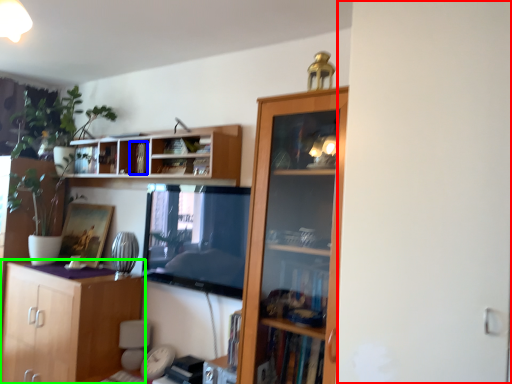
Question: Estimate the real-world distances between objects in this image. Which object is closer to screen door (highlighted by a red box), book (highlighted by a blue box) or cabinetry (highlighted by a green box)?

Choices:
 (A) book
 (B) cabinetry

Answer: (A)